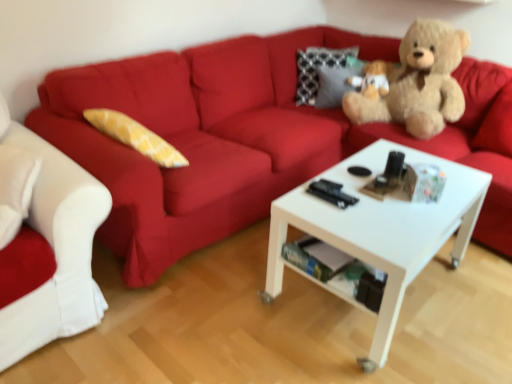
What do you see at coordinates (381, 229) in the screenshot? The width and height of the screenshot is (512, 384). I see `white matte coffee table at center` at bounding box center [381, 229].

The height and width of the screenshot is (384, 512). In order to click on white matte coffee table at center in this screenshot , I will do `click(381, 229)`.

Find the location of `white fabric couch at left, which is the second studio couch in right-to-left order`. white fabric couch at left, which is the second studio couch in right-to-left order is located at coordinates (45, 243).

Between soft brown teddy bear at upper right and white matte coffee table at center, which one has more height?

Standing taller between the two is soft brown teddy bear at upper right.

Is soft brown teddy bear at upper right positioned beyond the bounds of white matte coffee table at center?

Yes, soft brown teddy bear at upper right is not within white matte coffee table at center.

Looking at their sizes, would you say soft brown teddy bear at upper right is wider or thinner than white matte coffee table at center?

In the image, soft brown teddy bear at upper right appears to be more narrow than white matte coffee table at center.

From a real-world perspective, is soft brown teddy bear at upper right on white matte coffee table at center?

Indeed, from a real-world perspective, soft brown teddy bear at upper right stands above white matte coffee table at center.

Is white matte coffee table at center oriented towards white fabric couch at left, which is the first studio couch from left to right?

No, white matte coffee table at center is not aimed at white fabric couch at left, which is the first studio couch from left to right.

Which is closer, [411,280] or [62,265]?

The point [62,265] is closer.

Do you think white matte coffee table at center is within white fabric couch at left, which is the first studio couch from left to right, or outside of it?

white matte coffee table at center is spatially situated outside white fabric couch at left, which is the first studio couch from left to right.

Looking at their sizes, would you say white fabric couch at left, which is the second studio couch in right-to-left order, is wider or thinner than matte red couch at upper center, marked as the first studio couch in a right-to-left arrangement?

Clearly, white fabric couch at left, which is the second studio couch in right-to-left order, has less width compared to matte red couch at upper center, marked as the first studio couch in a right-to-left arrangement.

From a real-world perspective, is white fabric couch at left, which is the second studio couch in right-to-left order, physically below matte red couch at upper center, marked as the first studio couch in a right-to-left arrangement?

No, from a real-world perspective, white fabric couch at left, which is the second studio couch in right-to-left order, is not below matte red couch at upper center, marked as the first studio couch in a right-to-left arrangement.

Is the position of white fabric couch at left, which is the first studio couch from left to right, more distant than that of matte red couch at upper center, marked as the first studio couch in a right-to-left arrangement?

That is True.

Is white fabric couch at left, which is the first studio couch from left to right, facing towards matte red couch at upper center, arranged as the 2th studio couch when viewed from the left?

No, white fabric couch at left, which is the first studio couch from left to right, is not oriented towards matte red couch at upper center, arranged as the 2th studio couch when viewed from the left.

In the scene shown: From the image's perspective, which is above, white matte coffee table at center or matte red couch at upper center, arranged as the 2th studio couch when viewed from the left?

matte red couch at upper center, arranged as the 2th studio couch when viewed from the left, is shown above in the image.

Is matte red couch at upper center, arranged as the 2th studio couch when viewed from the left, at the back of white matte coffee table at center?

Yes, white matte coffee table at center is facing away from matte red couch at upper center, arranged as the 2th studio couch when viewed from the left.

From a real-world perspective, who is located lower, white matte coffee table at center or matte red couch at upper center, marked as the first studio couch in a right-to-left arrangement?

white matte coffee table at center is physically lower.

Is white matte coffee table at center not close to matte red couch at upper center, arranged as the 2th studio couch when viewed from the left?

white matte coffee table at center is actually quite close to matte red couch at upper center, arranged as the 2th studio couch when viewed from the left.

Who is more distant, matte red couch at upper center, arranged as the 2th studio couch when viewed from the left, or soft brown teddy bear at upper right?

soft brown teddy bear at upper right is behind.

From a real-world perspective, which object rests below the other?

matte red couch at upper center, arranged as the 2th studio couch when viewed from the left, is physically lower.

From the image's perspective, relative to soft brown teddy bear at upper right, is matte red couch at upper center, arranged as the 2th studio couch when viewed from the left, above or below?

From the image's perspective, matte red couch at upper center, arranged as the 2th studio couch when viewed from the left, appears below soft brown teddy bear at upper right.

Does matte red couch at upper center, marked as the first studio couch in a right-to-left arrangement, have a lesser width compared to soft brown teddy bear at upper right?

No.

From the image's perspective, between white matte coffee table at center and soft brown teddy bear at upper right, which one is located above?

soft brown teddy bear at upper right, from the image's perspective.

Which is correct: white matte coffee table at center is inside soft brown teddy bear at upper right, or outside of it?

white matte coffee table at center exists outside the volume of soft brown teddy bear at upper right.

From a real-world perspective, is white matte coffee table at center physically located above or below soft brown teddy bear at upper right?

From a real-world perspective, white matte coffee table at center is physically below soft brown teddy bear at upper right.

Which is in front, white matte coffee table at center or soft brown teddy bear at upper right?

white matte coffee table at center is more forward.

How different are the orientations of white fabric couch at left, which is the second studio couch in right-to-left order, and soft brown teddy bear at upper right in degrees?

The angle between the facing direction of white fabric couch at left, which is the second studio couch in right-to-left order, and the facing direction of soft brown teddy bear at upper right is 5.59 degrees.

Is the depth of white fabric couch at left, which is the second studio couch in right-to-left order, greater than that of soft brown teddy bear at upper right?

No, it is not.

Does point (59, 250) come behind point (419, 44)?

No, it is in front of (419, 44).

Is white fabric couch at left, which is the first studio couch from left to right, facing away from soft brown teddy bear at upper right?

Yes, white fabric couch at left, which is the first studio couch from left to right, is facing away from soft brown teddy bear at upper right.

Locate an element on the screen. The image size is (512, 384). teddy bear above the white matte coffee table at center (from a real-world perspective) is located at coordinates (418, 83).

Which studio couch is the 2nd one when counting from the left side of the white matte coffee table at center? Please provide its 2D coordinates.

[(45, 243)]

From the image, which object appears to be farther from soft brown teddy bear at upper right, white matte coffee table at center or matte red couch at upper center, arranged as the 2th studio couch when viewed from the left?

Among the two, white matte coffee table at center is located further to soft brown teddy bear at upper right.

Considering their positions, is matte red couch at upper center, marked as the first studio couch in a right-to-left arrangement, positioned further to white matte coffee table at center than white fabric couch at left, which is the first studio couch from left to right?

Based on the image, white fabric couch at left, which is the first studio couch from left to right, appears to be further to white matte coffee table at center.

Based on their spatial positions, is soft brown teddy bear at upper right or white matte coffee table at center further from matte red couch at upper center, arranged as the 2th studio couch when viewed from the left?

white matte coffee table at center.

When comparing their distances from matte red couch at upper center, arranged as the 2th studio couch when viewed from the left, does white fabric couch at left, which is the second studio couch in right-to-left order, or white matte coffee table at center seem closer?

Based on the image, white fabric couch at left, which is the second studio couch in right-to-left order, appears to be nearer to matte red couch at upper center, arranged as the 2th studio couch when viewed from the left.

Based on their spatial positions, is white fabric couch at left, which is the first studio couch from left to right, or matte red couch at upper center, marked as the first studio couch in a right-to-left arrangement, closer to white matte coffee table at center?

matte red couch at upper center, marked as the first studio couch in a right-to-left arrangement.

From the image, which object appears to be farther from matte red couch at upper center, arranged as the 2th studio couch when viewed from the left, white matte coffee table at center or white fabric couch at left, which is the second studio couch in right-to-left order?

white matte coffee table at center is further to matte red couch at upper center, arranged as the 2th studio couch when viewed from the left.

Considering their positions, is white fabric couch at left, which is the second studio couch in right-to-left order, positioned closer to white matte coffee table at center than soft brown teddy bear at upper right?

Based on the image, soft brown teddy bear at upper right appears to be nearer to white matte coffee table at center.

When comparing their distances from soft brown teddy bear at upper right, does matte red couch at upper center, marked as the first studio couch in a right-to-left arrangement, or white fabric couch at left, which is the second studio couch in right-to-left order, seem closer?

matte red couch at upper center, marked as the first studio couch in a right-to-left arrangement.

I want to click on studio couch located between white fabric couch at left, which is the second studio couch in right-to-left order, and soft brown teddy bear at upper right in the left-right direction, so click(238, 139).

Where is `coffee table between matte red couch at upper center, arranged as the 2th studio couch when viewed from the left, and soft brown teddy bear at upper right from front to back`? The height and width of the screenshot is (384, 512). coffee table between matte red couch at upper center, arranged as the 2th studio couch when viewed from the left, and soft brown teddy bear at upper right from front to back is located at coordinates (x=381, y=229).

I want to click on coffee table between white fabric couch at left, which is the second studio couch in right-to-left order, and soft brown teddy bear at upper right, so click(381, 229).

Where is `studio couch situated between white fabric couch at left, which is the second studio couch in right-to-left order, and white matte coffee table at center from left to right`? The height and width of the screenshot is (384, 512). studio couch situated between white fabric couch at left, which is the second studio couch in right-to-left order, and white matte coffee table at center from left to right is located at coordinates (238, 139).